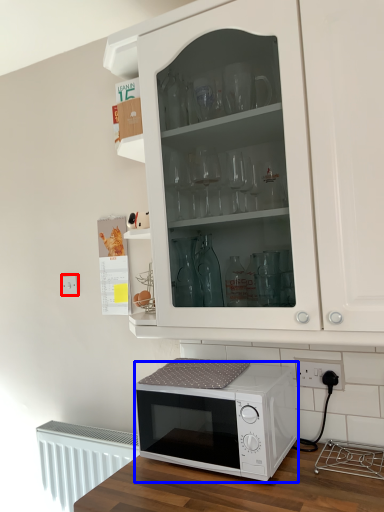
Question: Among these objects, which one is farthest to the camera, electric outlet (highlighted by a red box) or microwave oven (highlighted by a blue box)?

Choices:
 (A) electric outlet
 (B) microwave oven

Answer: (A)